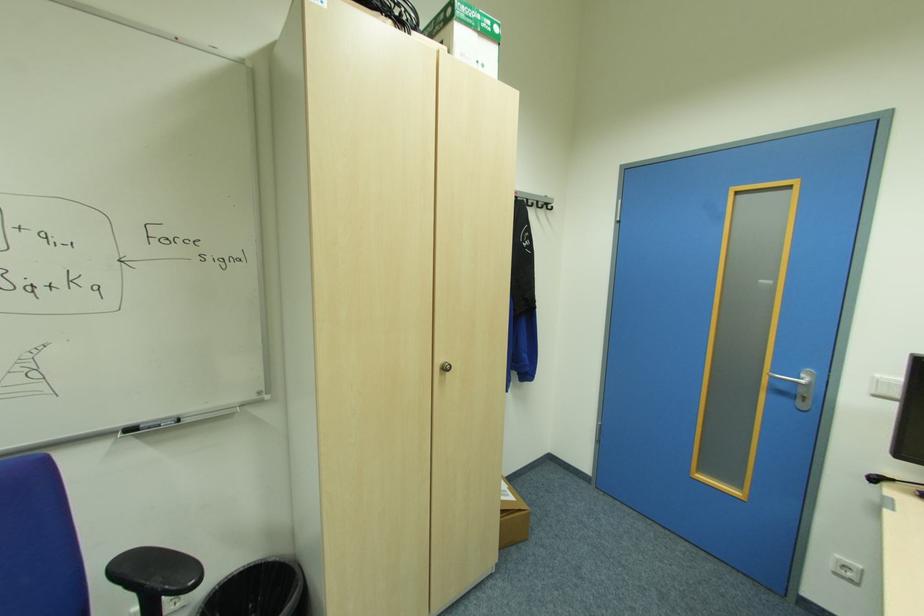
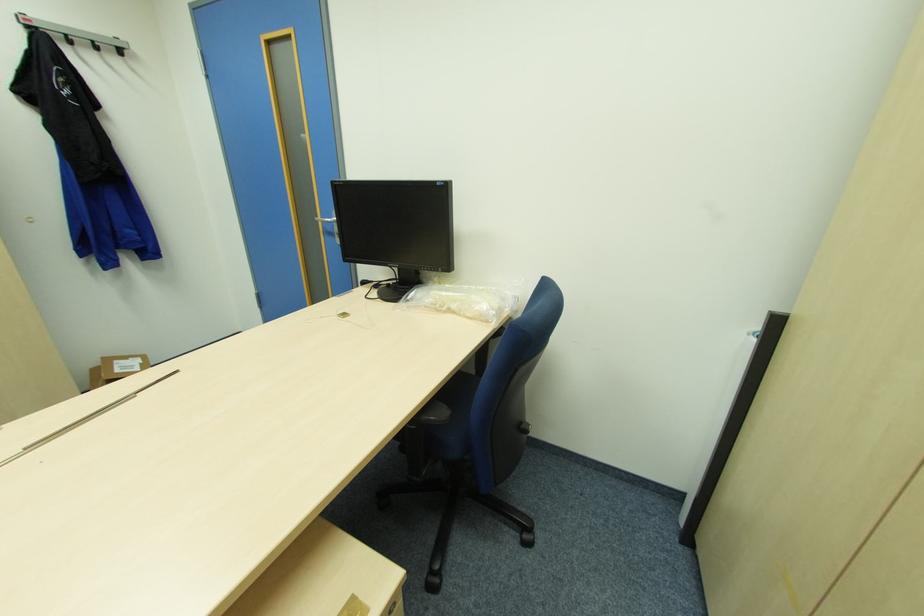
What movement of the cameraman would produce the second image?

The cameraman moved toward right, backward.